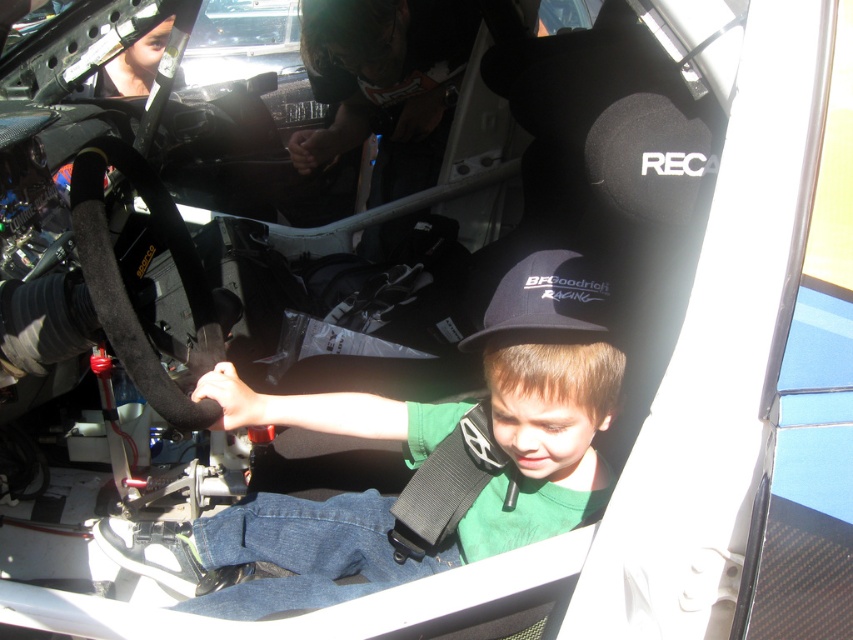
Question: From the image, what is the correct spatial relationship of green fabric shirt at center in relation to black fabric baseball cap at center?

Choices:
 (A) above
 (B) below

Answer: (B)

Question: Among these objects, which one is nearest to the camera?

Choices:
 (A) green fabric shirt at center
 (B) black fabric baseball cap at center

Answer: (B)

Question: Is green fabric shirt at center wider than black fabric baseball cap at center?

Choices:
 (A) yes
 (B) no

Answer: (A)

Question: Does green fabric shirt at center have a smaller size compared to black fabric baseball cap at center?

Choices:
 (A) no
 (B) yes

Answer: (A)

Question: Which point appears closest to the camera in this image?

Choices:
 (A) (521, 259)
 (B) (277, 502)

Answer: (A)